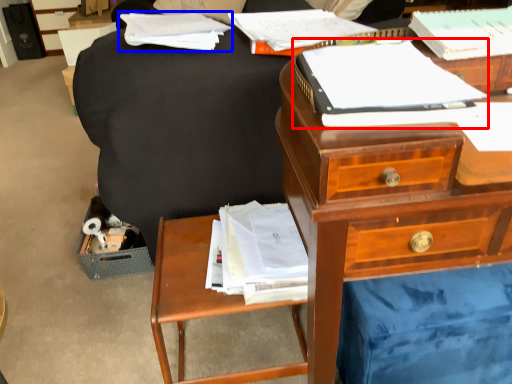
Question: Among these objects, which one is nearest to the camera, paperback book (highlighted by a red box) or book (highlighted by a blue box)?

Choices:
 (A) paperback book
 (B) book

Answer: (A)